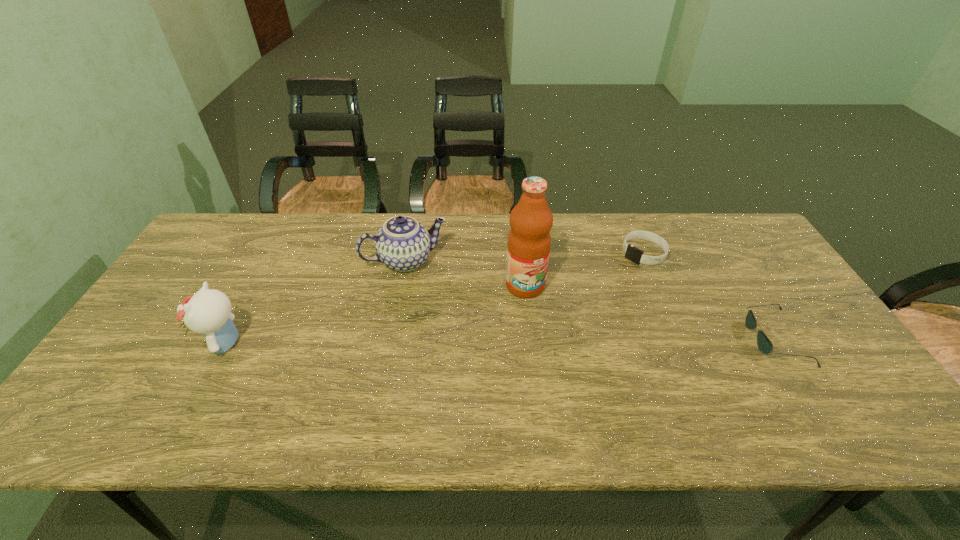
At what (x,y) coordinates should I click in order to perform the action: click on vacant area between the wristband and the kitten. Please return your answer as a coordinate pair (x, y). The height and width of the screenshot is (540, 960). Looking at the image, I should click on (435, 298).

Identify which object is the nearest to the rightmost object. Please provide its 2D coordinates. Your answer should be formatted as a tuple, i.e. [(x, y)], where the tuple contains the x and y coordinates of a point satisfying the conditions above.

[(632, 253)]

Select which object is the fourth closest to the tallest object. Please provide its 2D coordinates. Your answer should be formatted as a tuple, i.e. [(x, y)], where the tuple contains the x and y coordinates of a point satisfying the conditions above.

[(208, 312)]

Locate an element on the screen. Image resolution: width=960 pixels, height=540 pixels. vacant position in the image that satisfies the following two spatial constraints: 1. on the back side of the chinaware; 2. on the right side of the second object from right to left is located at coordinates (407, 253).

This screenshot has width=960, height=540. What are the coordinates of `free location that satisfies the following two spatial constraints: 1. on the front side of the fourth object from left to right; 2. on the lenses of the rightmost object` in the screenshot? It's located at (680, 338).

The height and width of the screenshot is (540, 960). Find the location of `free spot that satisfies the following two spatial constraints: 1. on the front side of the fourth object from right to left; 2. on the lenses of the sunglasses`. free spot that satisfies the following two spatial constraints: 1. on the front side of the fourth object from right to left; 2. on the lenses of the sunglasses is located at coordinates (392, 338).